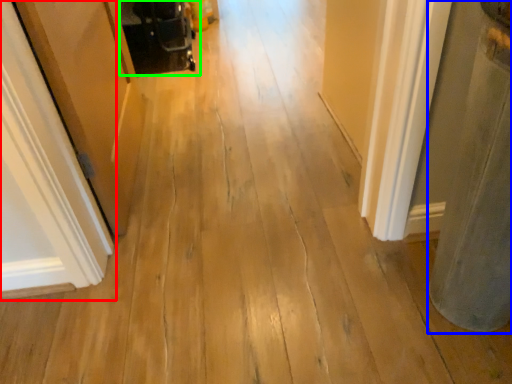
Question: Considering the real-world distances, which object is closest to door (highlighted by a red box)? pillar (highlighted by a blue box) or baby carriage (highlighted by a green box).

Choices:
 (A) pillar
 (B) baby carriage

Answer: (A)